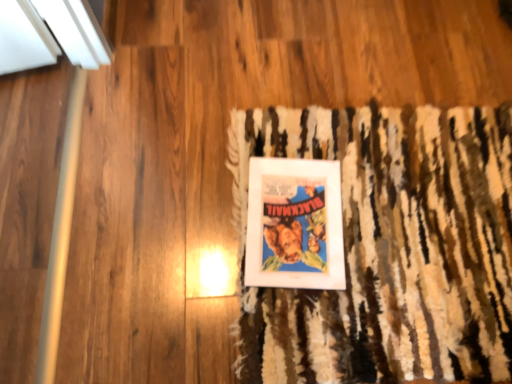
Identify the location of free location to the right of matte paper poster at center. This screenshot has width=512, height=384. (394, 226).